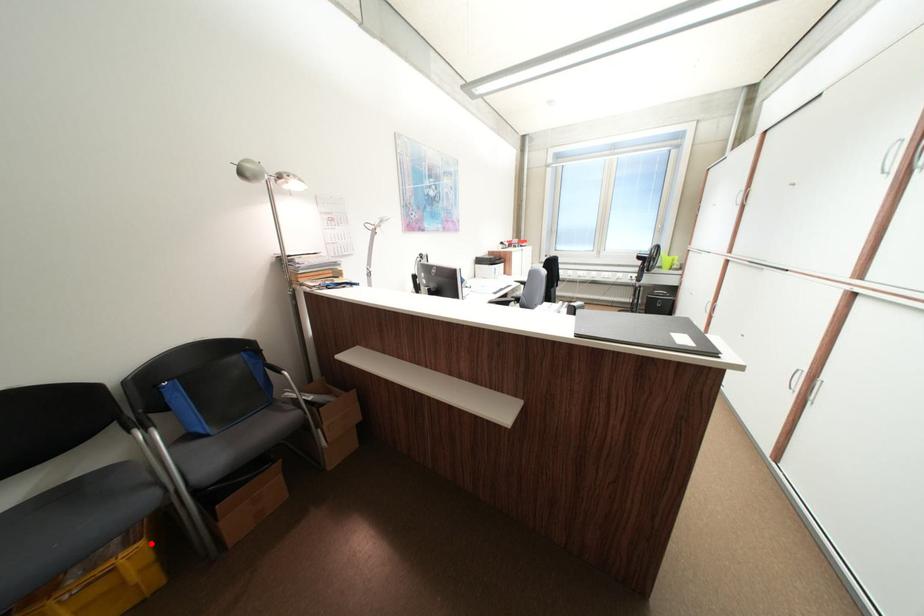
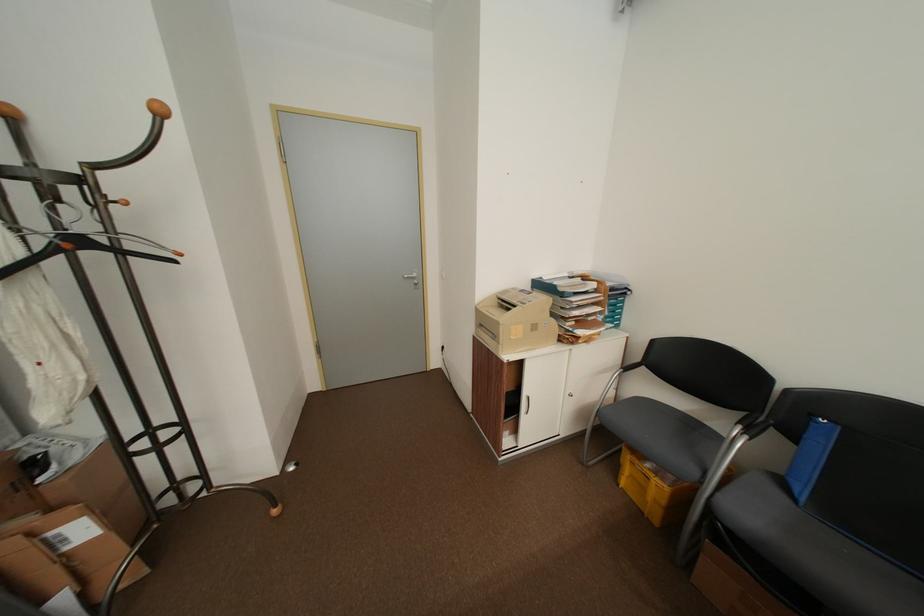
Locate, in the second image, the point that corresponds to the highlighted location in the first image.

(676, 488)